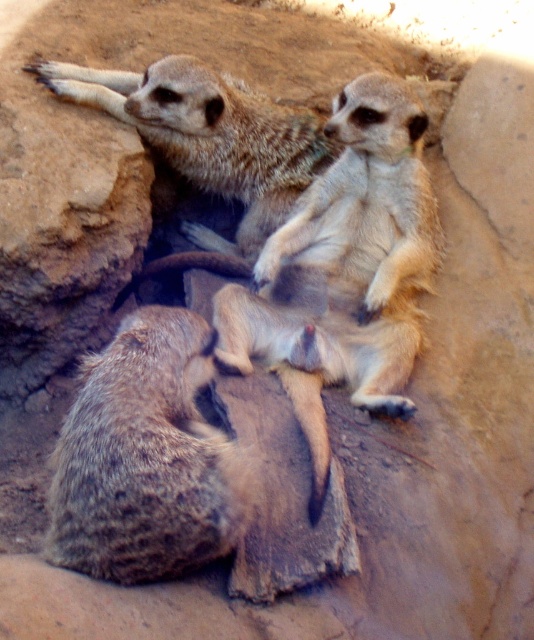
Question: Which of the following is the farthest from the observer?

Choices:
 (A) (103, 102)
 (B) (211, 449)

Answer: (A)

Question: Which of the following is the farthest from the observer?

Choices:
 (A) fuzzy brown meerkat at upper center
 (B) brown fuzzy meerkat at lower left

Answer: (A)

Question: Is brown fuzzy meerkat at lower left closer to the viewer compared to fuzzy brown meerkat at upper center?

Choices:
 (A) yes
 (B) no

Answer: (A)

Question: Does brown fuzzy meerkat at lower left appear under fuzzy brown meerkat at upper center?

Choices:
 (A) no
 (B) yes

Answer: (B)

Question: Can you confirm if brown fuzzy meerkat at lower left is positioned to the left of fuzzy brown meerkat at upper center?

Choices:
 (A) no
 (B) yes

Answer: (B)